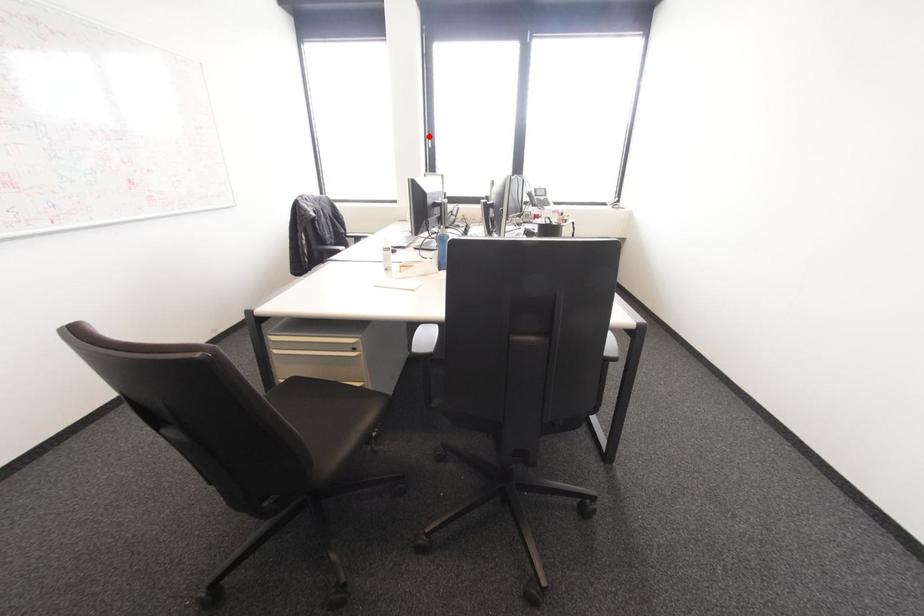
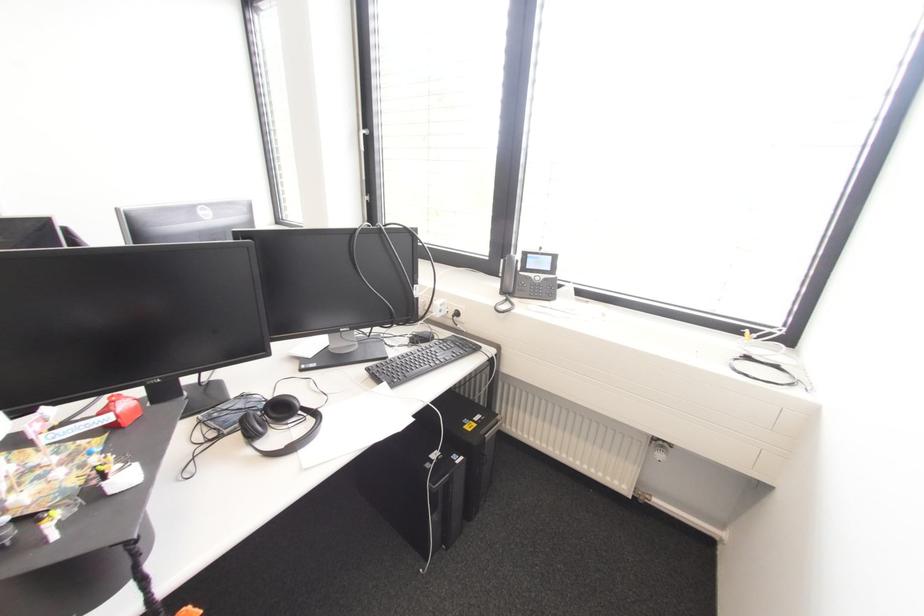
Where in the second image is the point corresponding to the highlighted location from the first image?

(361, 132)